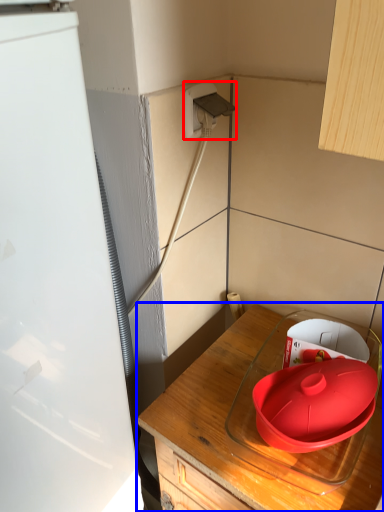
Question: Which of the following is the closest to the observer, electric outlet (highlighted by a red box) or countertop (highlighted by a blue box)?

Choices:
 (A) electric outlet
 (B) countertop

Answer: (B)